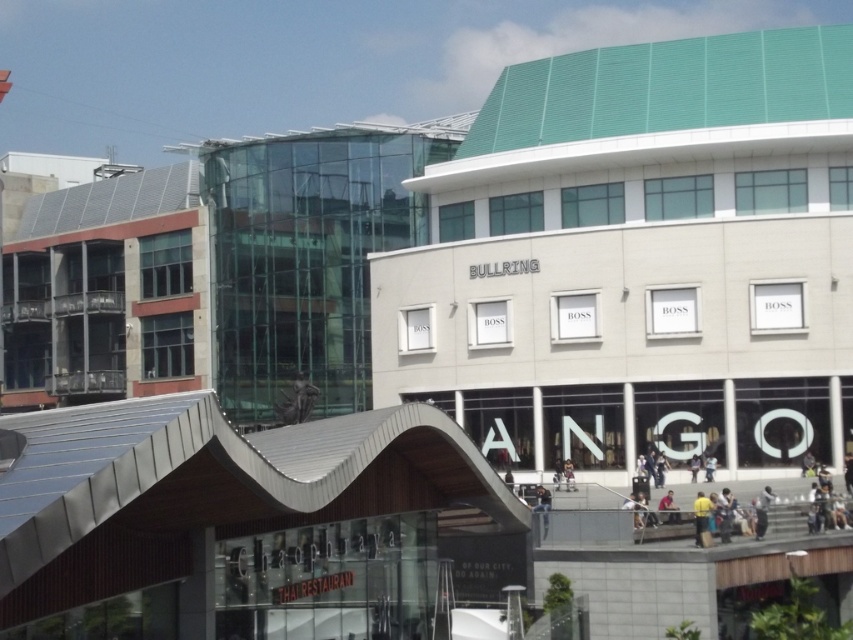
You are a customer looking for the Chaophraya restaurant. You see the light gray fabric jacket at lower right and the light brown leather jacket at center. Which jacket is closer to the restaurant entrance?

The light gray fabric jacket at lower right is located above the light brown leather jacket at center, so the light gray fabric jacket at lower right is closer to the restaurant entrance.

You are a photographer standing in the shopping arcade. You notice two people in the scene, one wearing a yellow shirt at lower right and another wearing a light brown leather jacket at lower center. Which person is standing closer to the photographer?

The yellow shirt at lower right is much taller as light brown leather jacket at lower center, so the person in the yellow shirt at lower right is closer to the photographer because objects that appear taller are typically closer to the viewer.

You are a photographer standing at the entrance of the shopping arcade. You see a person wearing a yellow shirt at lower right and another wearing a light brown leather jacket at lower center. Which person is closer to you?

The yellow shirt at lower right is in front of the light brown leather jacket at lower center, so the person wearing the yellow shirt at lower right is closer to you.